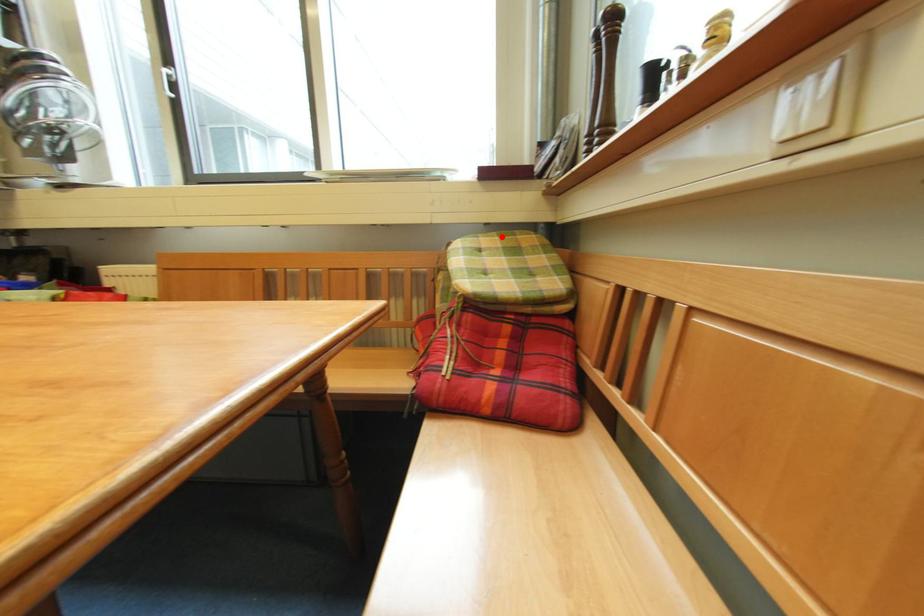
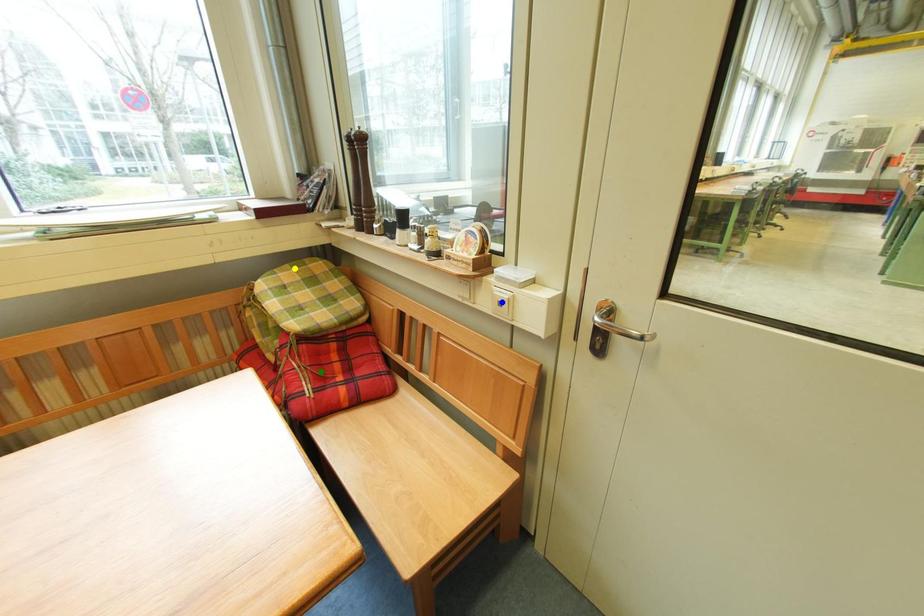
Question: I am providing you with two images of the same scene from different viewpoints. A red point is marked on the first image. You are given multiple points on the second image. Which mark in image 2 goes with the point in image 1?

Choices:
 (A) yellow point
 (B) green point
 (C) blue point

Answer: (A)